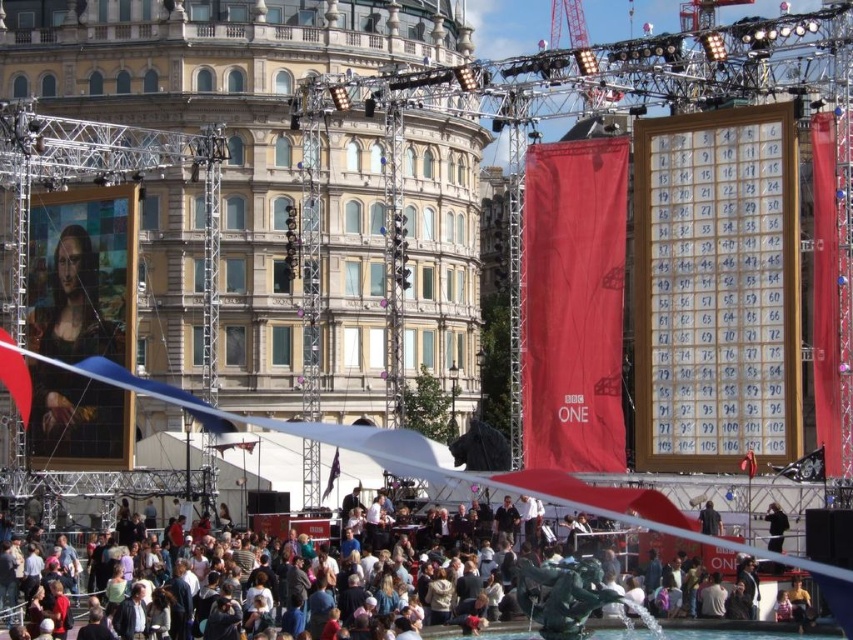
Question: Can you confirm if black fabric person at center is wider than dark blue fabric at center?

Choices:
 (A) no
 (B) yes

Answer: (A)

Question: Is dark gray fabric crowd at lower center closer to camera compared to black fabric person at center?

Choices:
 (A) yes
 (B) no

Answer: (A)

Question: Among these points, which one is nearest to the camera?

Choices:
 (A) (705, 502)
 (B) (766, 518)
 (C) (721, 600)

Answer: (C)

Question: Estimate the real-world distances between objects in this image. Which object is closer to the dark blue fabric at center?

Choices:
 (A) dark gray fabric crowd at lower center
 (B) black fabric person at center

Answer: (B)

Question: Which object is farther from the camera taking this photo?

Choices:
 (A) dark blue fabric at center
 (B) dark gray fabric crowd at lower center
 (C) black fabric person at center

Answer: (A)

Question: Does black fabric person at center appear over dark blue fabric at center?

Choices:
 (A) yes
 (B) no

Answer: (B)